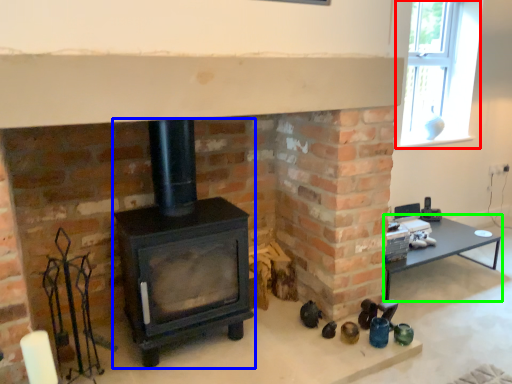
Question: Considering the real-world distances, which object is farthest from window (highlighted by a red box)? wood burning stove (highlighted by a blue box) or table (highlighted by a green box)?

Choices:
 (A) wood burning stove
 (B) table

Answer: (A)